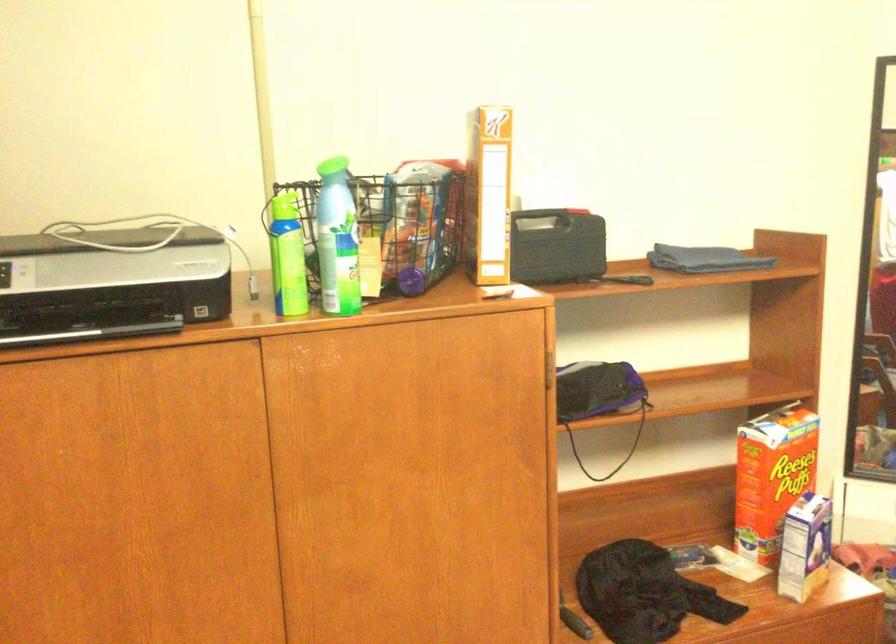
Locate an element on the screen. light green can cap is located at coordinates (288, 257).